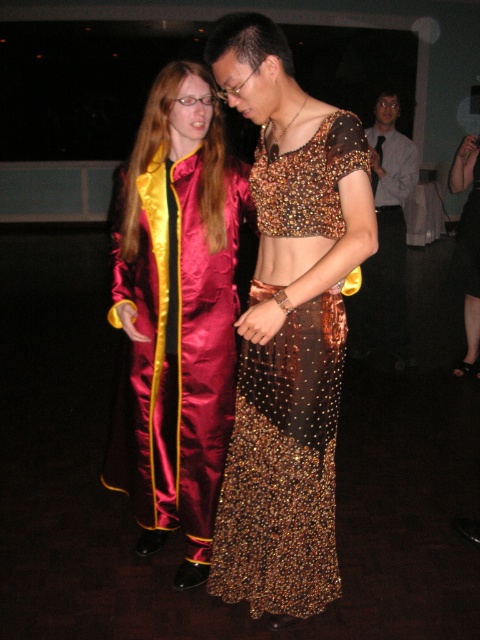
Is beaded sheer skirt at center to the right of gold sequined dress at center from the viewer's perspective?

In fact, beaded sheer skirt at center is to the left of gold sequined dress at center.

Does beaded sheer skirt at center appear over gold sequined dress at center?

No.

The width and height of the screenshot is (480, 640). In order to click on beaded sheer skirt at center in this screenshot , I will do `click(284, 467)`.

Between point (282, 170) and point (466, 320), which one is positioned in front?

Positioned in front is point (282, 170).

Which is more to the right, beaded sheer skirt at center or shiny satin robe at center?

shiny satin robe at center is more to the right.

The height and width of the screenshot is (640, 480). Find the location of `beaded sheer skirt at center`. beaded sheer skirt at center is located at coordinates (284, 467).

I want to click on beaded sheer skirt at center, so click(284, 467).

Can you confirm if shiny satin suit at center is positioned below satin/jacquard robe at center?

Yes.

Is point (338, 337) in front of point (202, 266)?

That is True.

This screenshot has width=480, height=640. What do you see at coordinates (288, 328) in the screenshot?
I see `shiny satin suit at center` at bounding box center [288, 328].

Where is `shiny satin suit at center`? The image size is (480, 640). shiny satin suit at center is located at coordinates (288, 328).